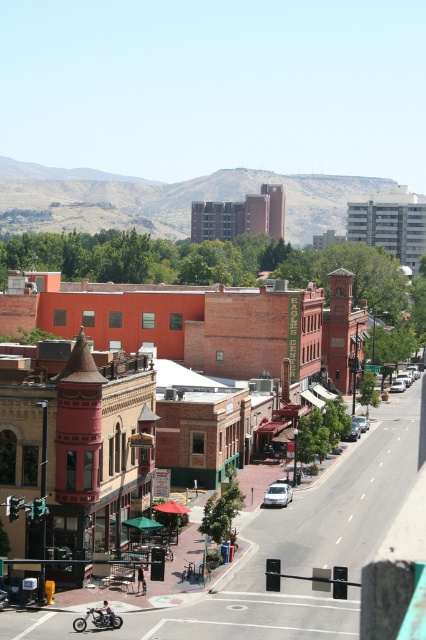
In the scene shown: Can you confirm if white matte car at center is positioned below white matte sedan at center-right?

Yes, white matte car at center is below white matte sedan at center-right.

Is white matte car at center further to the viewer compared to white matte sedan at center-right?

No, it is in front of white matte sedan at center-right.

Is point (278, 492) closer to viewer compared to point (351, 429)?

Yes, point (278, 492) is in front of point (351, 429).

Where is `white matte car at center`? white matte car at center is located at coordinates (278, 493).

Is shiny chrome motorcycle at lower left to the right of white matte car at center from the viewer's perspective?

Incorrect, shiny chrome motorcycle at lower left is not on the right side of white matte car at center.

Who is more forward, (115,618) or (270,499)?

Positioned in front is point (115,618).

Find the location of a particular element. This screenshot has width=426, height=640. shiny chrome motorcycle at lower left is located at coordinates (98, 618).

Between brick building at center and silver metallic sedan at center, which one is positioned lower?

silver metallic sedan at center

Where is `brick building at center`? The image size is (426, 640). brick building at center is located at coordinates (207, 323).

This screenshot has width=426, height=640. What are the coordinates of `brick building at center` in the screenshot? It's located at (207, 323).